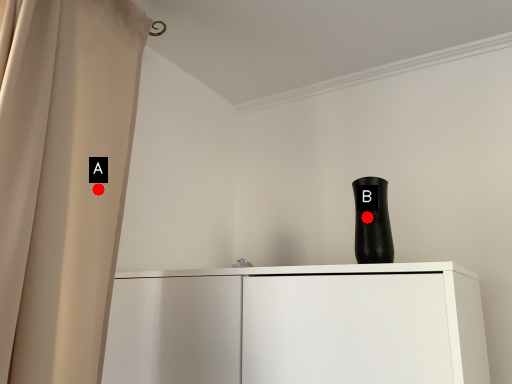
Question: Two points are circled on the image, labeled by A and B beside each circle. Which of the following is the closest to the observer?

Choices:
 (A) A is closer
 (B) B is closer

Answer: (B)